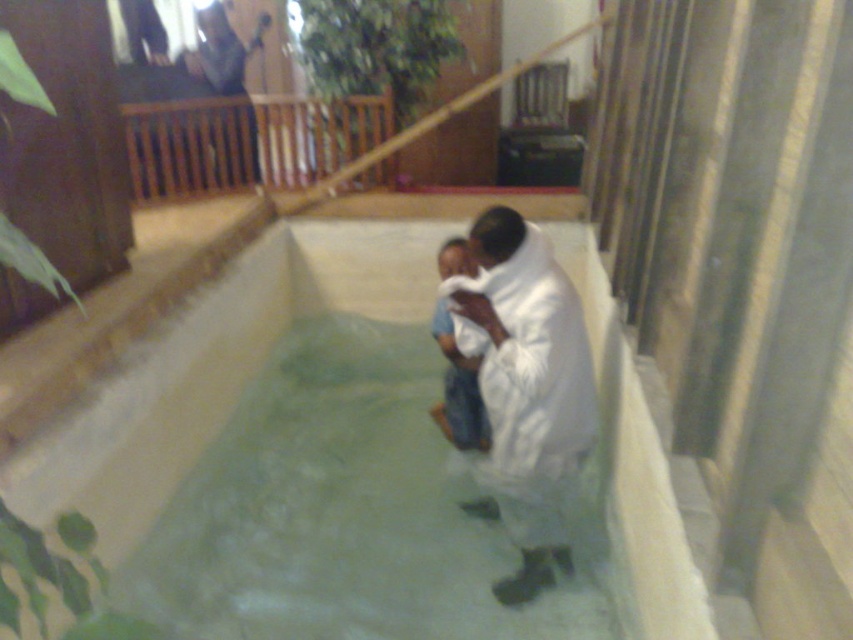
Who is lower down, white fluffy blanket at center or white cotton cloth at center?

white fluffy blanket at center is below.

Measure the distance between white fluffy blanket at center and white cotton cloth at center.

white fluffy blanket at center is 28.18 centimeters away from white cotton cloth at center.

Which is behind, point (524, 288) or point (445, 435)?

Point (445, 435)

The height and width of the screenshot is (640, 853). Identify the location of white fluffy blanket at center. (525, 388).

Measure the distance from white fabric at center to white fluffy blanket at center.

white fabric at center is 4.46 feet away from white fluffy blanket at center.

In the scene shown: Between white fabric at center and white fluffy blanket at center, which one appears on the right side from the viewer's perspective?

From the viewer's perspective, white fluffy blanket at center appears more on the right side.

This screenshot has height=640, width=853. I want to click on white fabric at center, so click(215, 369).

Where is `white fabric at center`? This screenshot has height=640, width=853. white fabric at center is located at coordinates (215, 369).

Is white fabric at center above matte black dress at upper center?

No.

Is point (357, 266) positioned behind point (212, 54)?

No.

Does point (206, 348) lie behind point (254, 33)?

No.

At what (x,y) coordinates should I click in order to perform the action: click on white fabric at center. Please return your answer as a coordinate pair (x, y). This screenshot has height=640, width=853. Looking at the image, I should click on (215, 369).